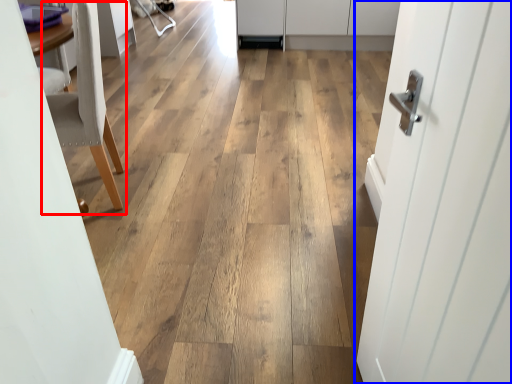
Question: Which object appears closest to the camera in this image, chair (highlighted by a red box) or door (highlighted by a blue box)?

Choices:
 (A) chair
 (B) door

Answer: (B)